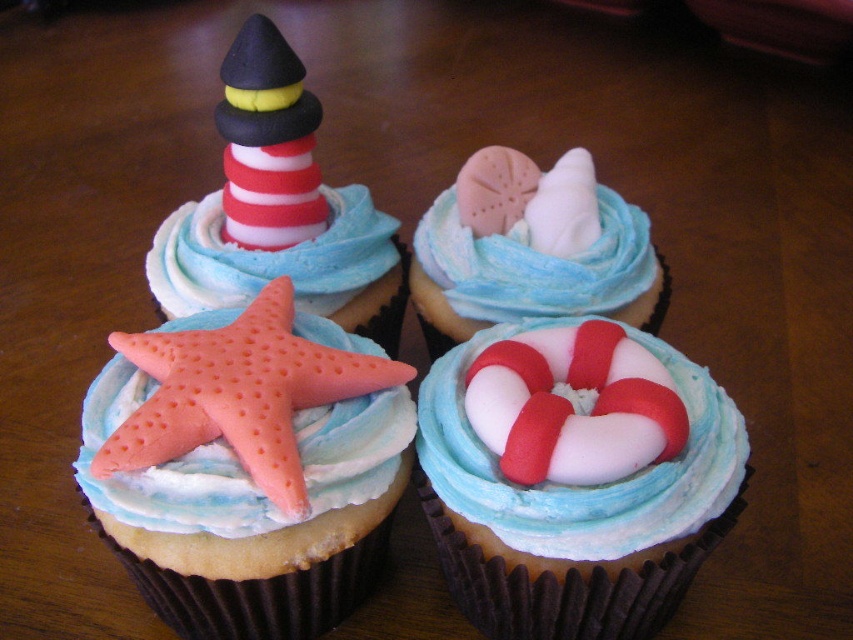
Is white fondant seashell at upper center behind matte pink starfish at upper left?

That is False.

Is point (457, 289) more distant than point (160, 312)?

No.

Is point (505, 220) farther from camera compared to point (337, 253)?

Yes.

Find the location of a particular element. white fondant seashell at upper center is located at coordinates 531,250.

Which of these two, white fondant seashell at upper center or pink matte starfish at center, stands taller?

white fondant seashell at upper center is taller.

Who is positioned more to the left, white fondant seashell at upper center or pink matte starfish at center?

From the viewer's perspective, pink matte starfish at center appears more on the left side.

Who is more forward, (509,243) or (184,440)?

Point (184,440) is more forward.

Locate an element on the screen. This screenshot has height=640, width=853. white fondant seashell at upper center is located at coordinates (531, 250).

Between smooth white life preserver at center and pink matte starfish at center, which one appears on the right side from the viewer's perspective?

From the viewer's perspective, smooth white life preserver at center appears more on the right side.

Between smooth white life preserver at center and pink matte starfish at center, which one is positioned higher?

Positioned higher is pink matte starfish at center.

Which is behind, point (572, 321) or point (294, 481)?

Positioned behind is point (572, 321).

You are a GUI agent. You are given a task and a screenshot of the screen. Output one action in this format:
    pyautogui.click(x=<x>, y=<y>)
    Task: Click on the smooth white life preserver at center
    Image resolution: width=853 pixels, height=640 pixels.
    Given the screenshot: What is the action you would take?
    pyautogui.click(x=575, y=515)